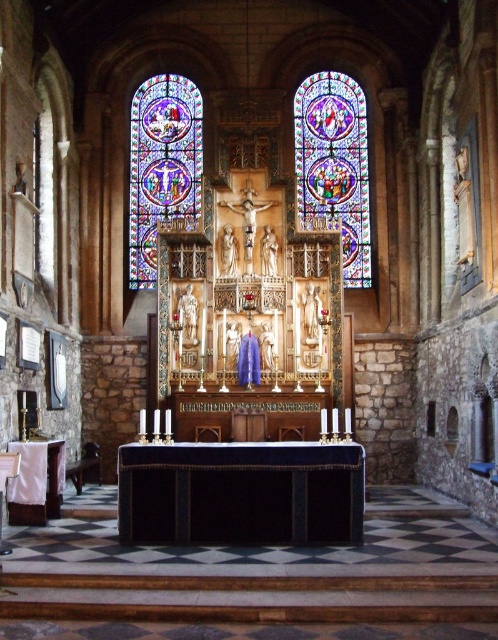
Consider the image. Between stained glass window at center and stained glass window at left, which one appears on the left side from the viewer's perspective?

Positioned to the left is stained glass window at left.

Can you confirm if stained glass window at center is positioned below stained glass window at left?

Incorrect, stained glass window at center is not positioned below stained glass window at left.

The width and height of the screenshot is (498, 640). Identify the location of stained glass window at center. (335, 166).

You are a GUI agent. You are given a task and a screenshot of the screen. Output one action in this format:
    pyautogui.click(x=<x>, y=<y>)
    Task: Click on the stained glass window at center
    
    Given the screenshot: What is the action you would take?
    pyautogui.click(x=335, y=166)